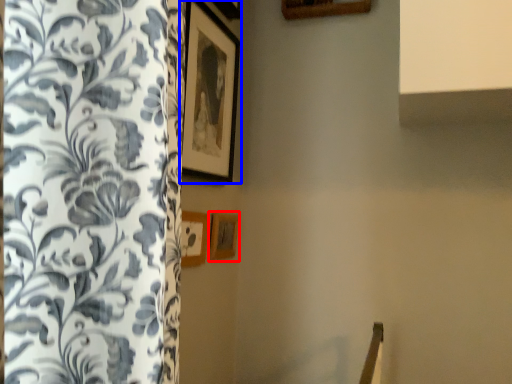
Question: Which object is further to the camera taking this photo, picture frame (highlighted by a red box) or picture frame (highlighted by a blue box)?

Choices:
 (A) picture frame
 (B) picture frame

Answer: (A)